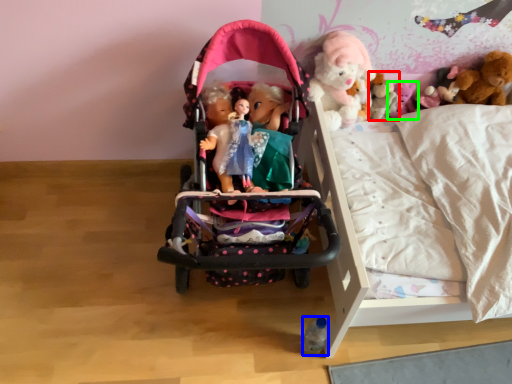
Question: Estimate the real-world distances between objects in this image. Which object is closer to doll (highlighted by a red box), toy (highlighted by a blue box) or toy (highlighted by a green box)?

Choices:
 (A) toy
 (B) toy

Answer: (B)